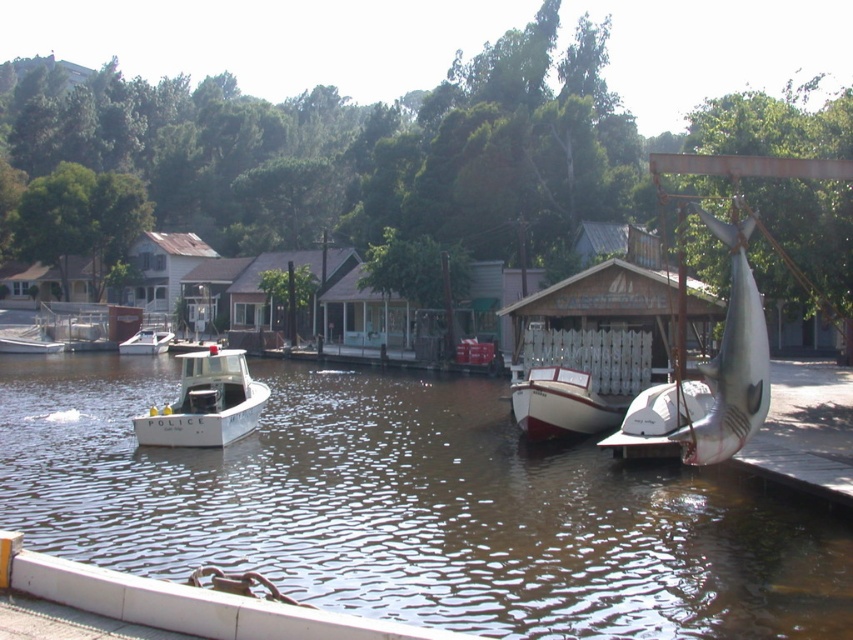
You are standing on the dock and looking at the brown water at center and the white matte police boat at left. Which object is located lower in the image?

The brown water at center is located lower than the white matte police boat at left in the image.

You are a photographer standing at the edge of the waterfront. You want to take a photo that includes both the point at coordinates point (225, 444) and point (149, 337). Which point will appear larger in your photo?

Point (225, 444) will appear larger in the photo because it is closer to the camera than point (149, 337).

You are a boat operator who needs to dock your vessel at the waterfront. You have a boat that is 12 feet long. The police boat is currently anchored in the water. Is there enough space between the brown water at center and the white matte police boat at left to safely maneuver your boat without hitting either?

The brown water at center and the white matte police boat at left are 13.89 feet apart from each other. Since your boat is 12 feet long, there is sufficient space to maneuver safely between them without collision.